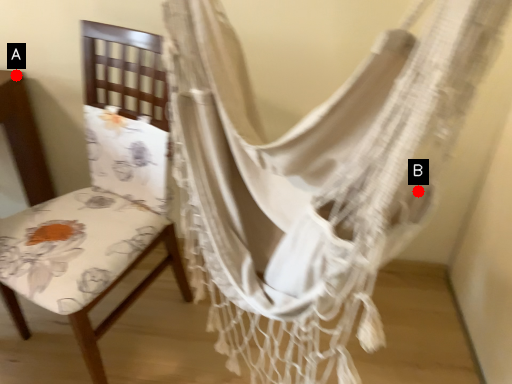
Question: Two points are circled on the image, labeled by A and B beside each circle. Which point appears closest to the camera in this image?

Choices:
 (A) A is closer
 (B) B is closer

Answer: (B)